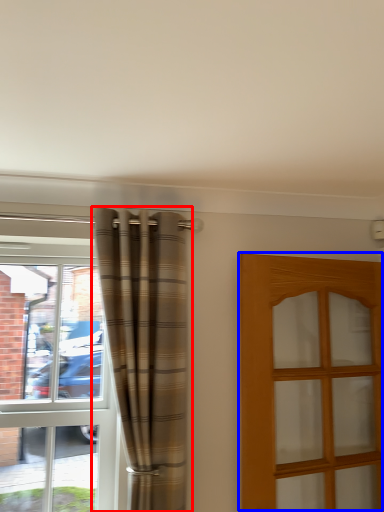
Question: Which object appears farthest to the camera in this image, curtain (highlighted by a red box) or door (highlighted by a blue box)?

Choices:
 (A) curtain
 (B) door

Answer: (A)